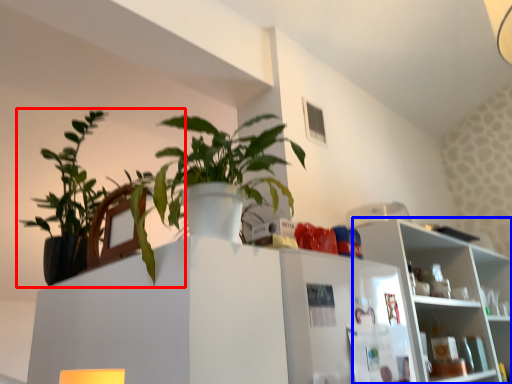
Question: Which point is further to the camera, houseplant (highlighted by a red box) or shelf (highlighted by a blue box)?

Choices:
 (A) houseplant
 (B) shelf

Answer: (B)